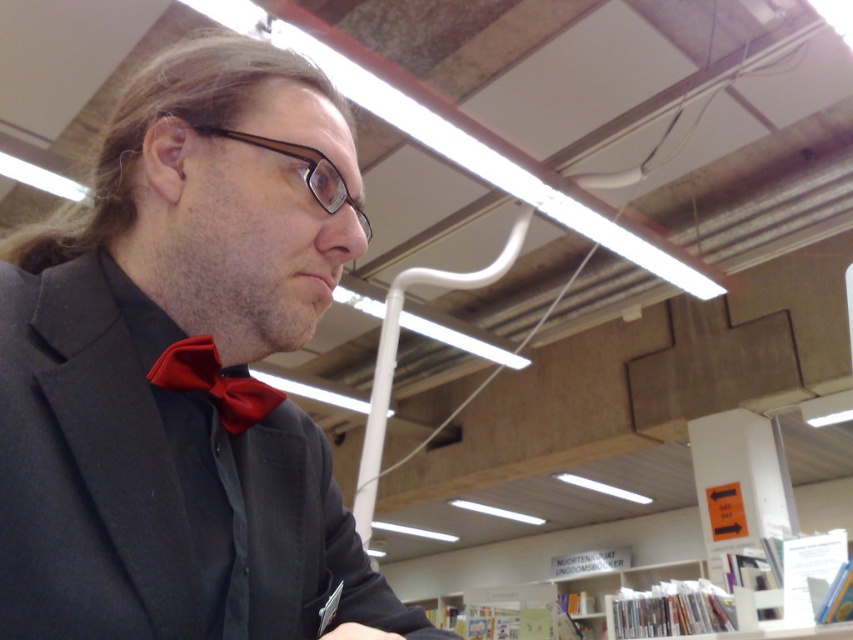
Question: Among these points, which one is nearest to the camera?

Choices:
 (A) coord(90,502)
 (B) coord(207,132)
 (C) coord(170,387)

Answer: (A)

Question: Which object is the farthest from the matte red bow tie at center?

Choices:
 (A) brown plastic glasses at center
 (B) matte black suit at center

Answer: (A)

Question: Which object is closer to the camera taking this photo?

Choices:
 (A) brown plastic glasses at center
 (B) matte red bow tie at center

Answer: (B)

Question: Can you confirm if matte black suit at center is bigger than matte red bow tie at center?

Choices:
 (A) no
 (B) yes

Answer: (B)

Question: Does matte black suit at center appear on the left side of matte red bow tie at center?

Choices:
 (A) no
 (B) yes

Answer: (A)

Question: Is matte black suit at center positioned before brown plastic glasses at center?

Choices:
 (A) no
 (B) yes

Answer: (B)